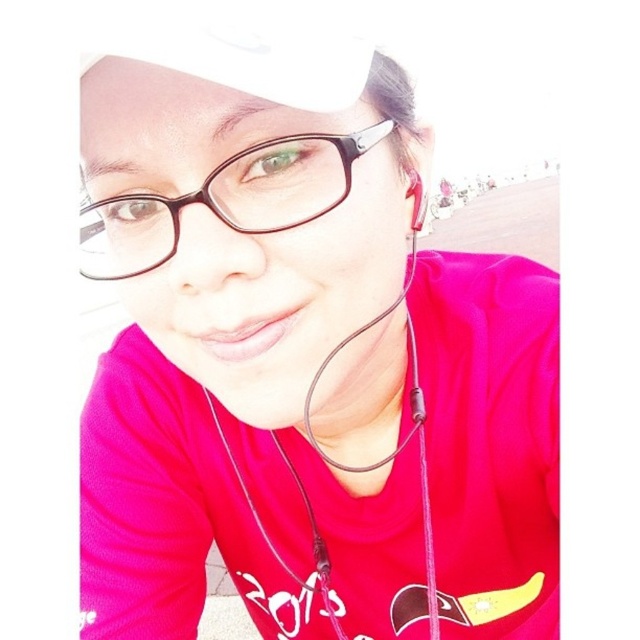
Question: Is black plastic glasses at center to the right of matte black earphone at upper center from the viewer's perspective?

Choices:
 (A) yes
 (B) no

Answer: (B)

Question: Based on their relative distances, which object is nearer to the black plastic glasses at center?

Choices:
 (A) matte black glasses at upper center
 (B) matte black earphones at center
 (C) matte black earphone at upper center

Answer: (B)

Question: Which object is positioned closest to the matte black earphones at center?

Choices:
 (A) matte black glasses at upper center
 (B) black plastic glasses at center
 (C) matte black earphone at upper center

Answer: (A)

Question: Does black plastic glasses at center come in front of matte black earphones at center?

Choices:
 (A) no
 (B) yes

Answer: (B)

Question: Which point is closer to the camera taking this photo?

Choices:
 (A) pyautogui.click(x=403, y=292)
 (B) pyautogui.click(x=225, y=186)

Answer: (B)

Question: Is matte black glasses at upper center closer to camera compared to black plastic glasses at center?

Choices:
 (A) no
 (B) yes

Answer: (B)